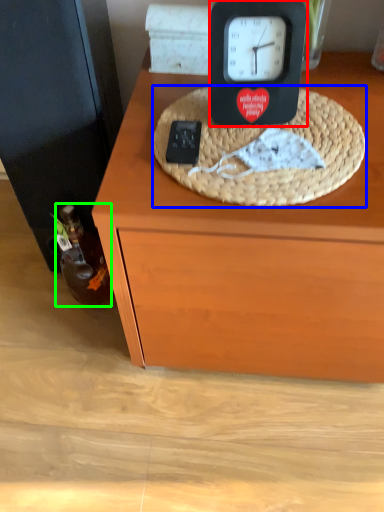
Question: Considering the real-world distances, which object is closest to clock (highlighted by a red box)? basket (highlighted by a blue box) or bottle (highlighted by a green box).

Choices:
 (A) basket
 (B) bottle

Answer: (A)